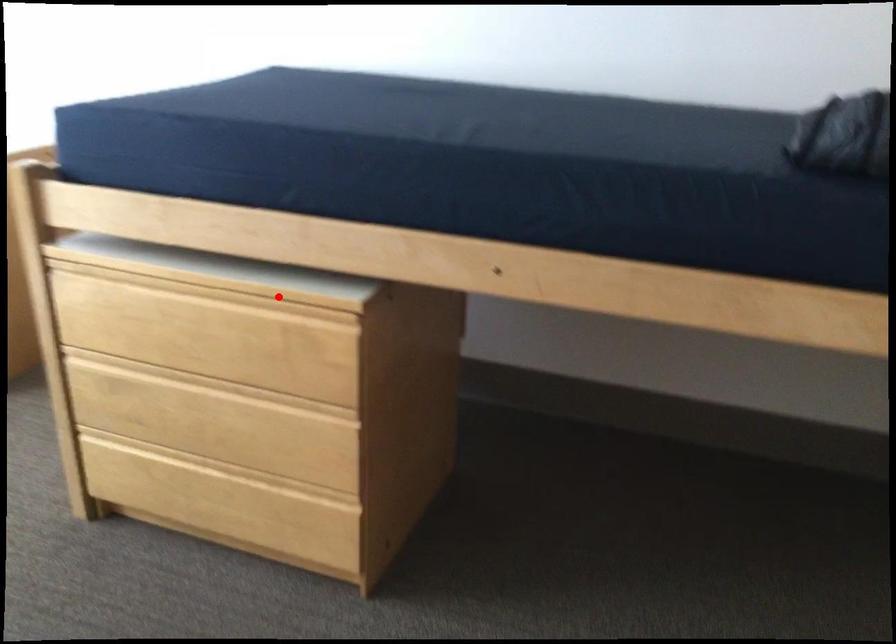
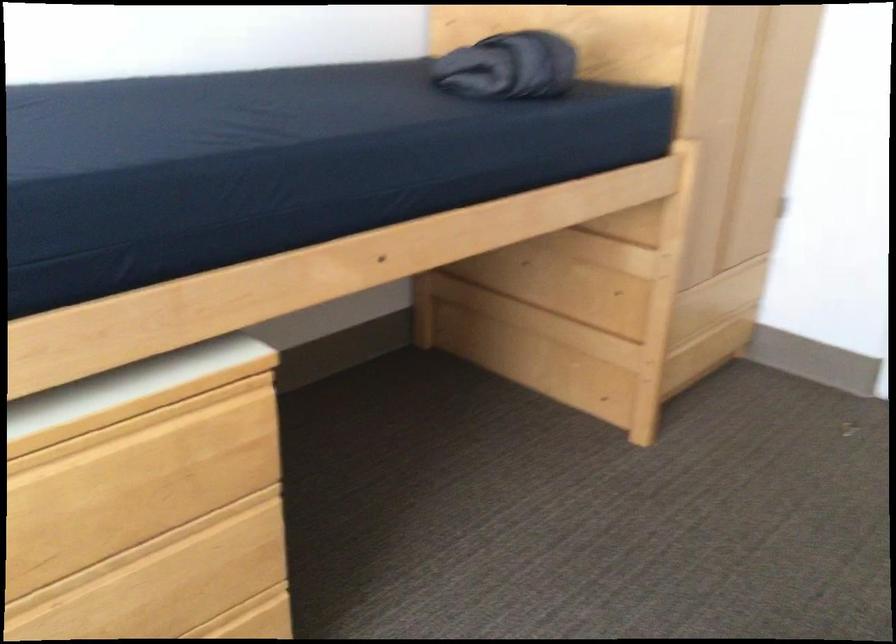
Question: I am providing you with two images of the same scene from different viewpoints. Given a red point in image1, look at the same physical point in image2. Is it:

Choices:
 (A) Closer to the viewpoint
 (B) Farther from the viewpoint

Answer: (A)